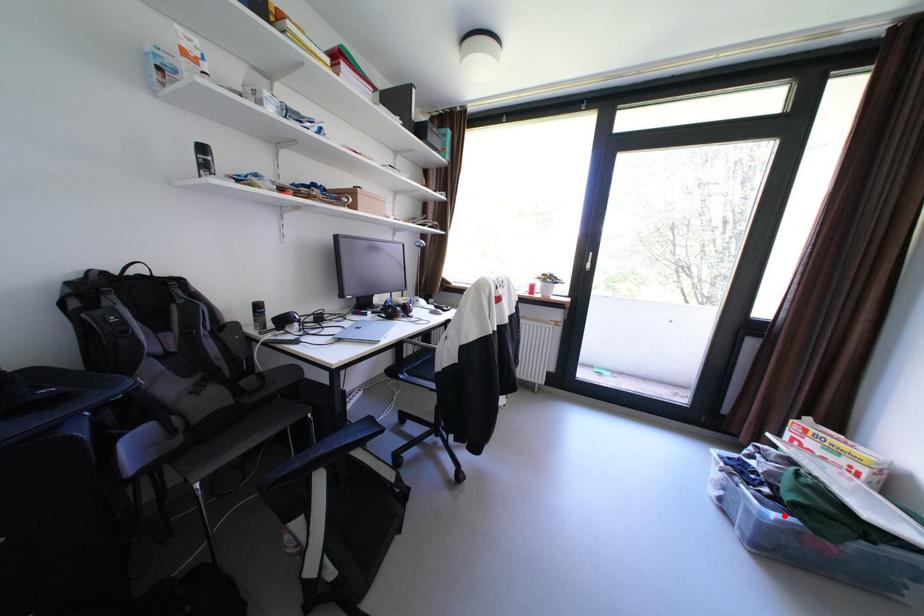
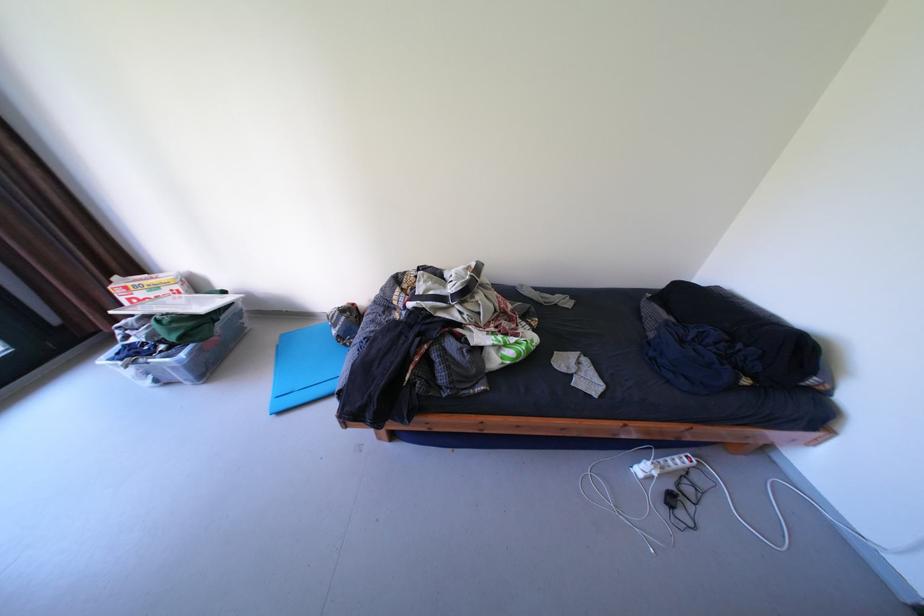
Question: A red point is marked in image1. In image2, is the corresponding 3D point closer to the camera or farther? Reply with the corresponding letter.

Choices:
 (A) The corresponding 3D point is closer.
 (B) The corresponding 3D point is farther.

Answer: (B)